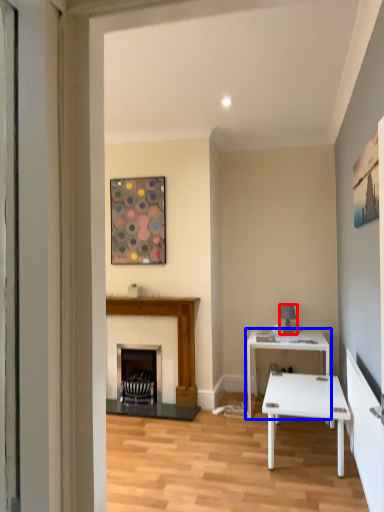
Question: Which object is further to the camera taking this photo, lamp (highlighted by a red box) or table (highlighted by a blue box)?

Choices:
 (A) lamp
 (B) table

Answer: (A)